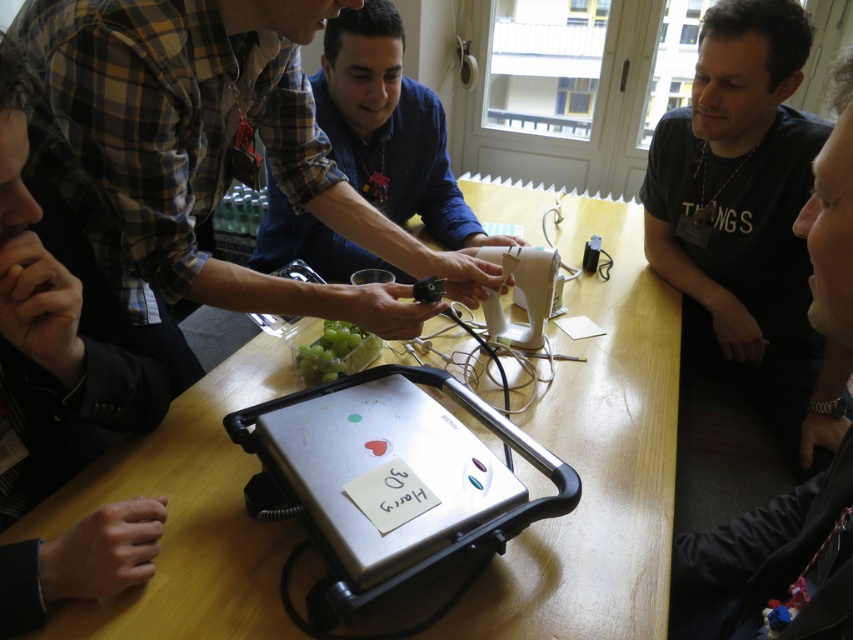
Question: Can you confirm if wooden table at center is positioned above green matte grapes at center?

Choices:
 (A) yes
 (B) no

Answer: (A)

Question: Which of these objects is positioned farthest from the green matte grapes at center?

Choices:
 (A) black matte shirt at upper right
 (B) matte black shirt at upper center

Answer: (A)

Question: Among these points, which one is nearest to the camera?

Choices:
 (A) (521, 262)
 (B) (277, 632)
 (C) (292, 332)
 (D) (434, 432)

Answer: (B)

Question: Which point appears closest to the camera in this image?

Choices:
 (A) (335, 352)
 (B) (669, 116)

Answer: (A)

Question: Can you confirm if matte black shirt at upper center is positioned below green matte grapes at center?

Choices:
 (A) no
 (B) yes

Answer: (A)

Question: From the image, what is the correct spatial relationship of plaid shirt at left in relation to green matte grapes at center?

Choices:
 (A) below
 (B) above

Answer: (B)